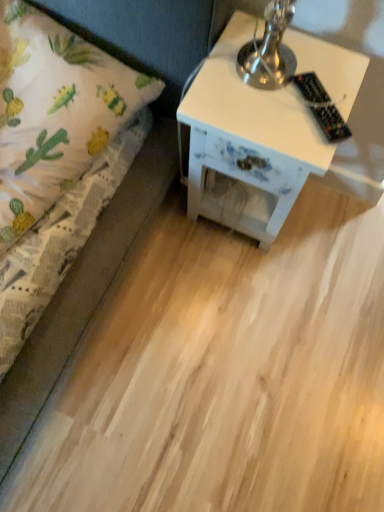
Question: Can you confirm if black plastic remote control at upper right is bigger than white painted wood nightstand at right?

Choices:
 (A) yes
 (B) no

Answer: (B)

Question: From a real-world perspective, is black plastic remote control at upper right below white painted wood nightstand at right?

Choices:
 (A) no
 (B) yes

Answer: (A)

Question: Is black plastic remote control at upper right wider than white painted wood nightstand at right?

Choices:
 (A) no
 (B) yes

Answer: (A)

Question: Are black plastic remote control at upper right and white painted wood nightstand at right making contact?

Choices:
 (A) no
 (B) yes

Answer: (A)

Question: Does black plastic remote control at upper right have a greater height compared to white painted wood nightstand at right?

Choices:
 (A) yes
 (B) no

Answer: (B)

Question: Considering the positions of point (117, 176) and point (309, 96), is point (117, 176) closer or farther from the camera than point (309, 96)?

Choices:
 (A) farther
 (B) closer

Answer: (A)

Question: Is white fabric bed at left taller or shorter than black plastic remote control at upper right?

Choices:
 (A) tall
 (B) short

Answer: (A)

Question: In the image, is white fabric bed at left positioned in front of or behind black plastic remote control at upper right?

Choices:
 (A) behind
 (B) front

Answer: (B)

Question: From the image's perspective, is white fabric bed at left positioned above or below black plastic remote control at upper right?

Choices:
 (A) below
 (B) above

Answer: (A)

Question: From the image's perspective, is white painted wood nightstand at right above or below white fabric bed at left?

Choices:
 (A) above
 (B) below

Answer: (A)

Question: Considering the positions of point (192, 108) and point (153, 80), is point (192, 108) closer or farther from the camera than point (153, 80)?

Choices:
 (A) farther
 (B) closer

Answer: (B)

Question: In the image, is white painted wood nightstand at right on the left side or the right side of white fabric bed at left?

Choices:
 (A) right
 (B) left

Answer: (A)

Question: Relative to white fabric bed at left, is white painted wood nightstand at right in front or behind?

Choices:
 (A) front
 (B) behind

Answer: (B)

Question: Does point (332, 119) appear closer or farther from the camera than point (241, 173)?

Choices:
 (A) closer
 (B) farther

Answer: (A)

Question: Which is correct: black plastic remote control at upper right is inside white painted wood nightstand at right, or outside of it?

Choices:
 (A) outside
 (B) inside

Answer: (A)